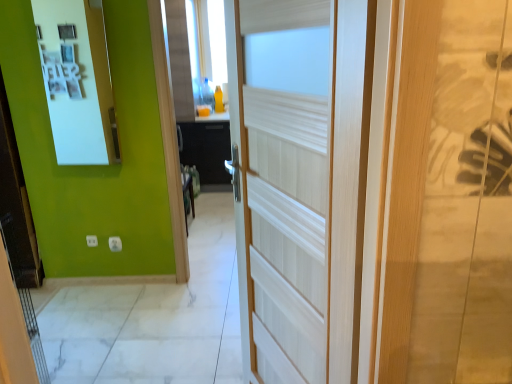
The width and height of the screenshot is (512, 384). I want to click on white glossy medicine cabinet at upper left, so click(x=77, y=81).

This screenshot has width=512, height=384. Describe the element at coordinates (77, 81) in the screenshot. I see `white glossy medicine cabinet at upper left` at that location.

What do you see at coordinates (376, 194) in the screenshot?
I see `white wood door at center` at bounding box center [376, 194].

This screenshot has height=384, width=512. Find the location of `white wood door at center`. white wood door at center is located at coordinates (376, 194).

At what (x,y) coordinates should I click in order to perform the action: click on white glossy medicine cabinet at upper left. Please return your answer as a coordinate pair (x, y). Looking at the image, I should click on (77, 81).

Is white glossy medicine cabinet at upper left to the left of white wood door at center from the viewer's perspective?

Indeed, white glossy medicine cabinet at upper left is positioned on the left side of white wood door at center.

Is white glossy medicine cabinet at upper left in front of or behind white wood door at center in the image?

white glossy medicine cabinet at upper left is behind white wood door at center.

Is point (59, 144) in front of point (260, 23)?

No, (59, 144) is behind (260, 23).

From the image's perspective, is white glossy medicine cabinet at upper left above or below white wood door at center?

Based on their image positions, white glossy medicine cabinet at upper left is located above white wood door at center.

From a real-world perspective, is white glossy medicine cabinet at upper left physically located above or below white wood door at center?

white glossy medicine cabinet at upper left is situated higher than white wood door at center in the real world.

Considering the relative sizes of white glossy medicine cabinet at upper left and white wood door at center in the image provided, is white glossy medicine cabinet at upper left wider than white wood door at center?

Incorrect, the width of white glossy medicine cabinet at upper left does not surpass that of white wood door at center.

In terms of height, does white glossy medicine cabinet at upper left look taller or shorter compared to white wood door at center?

In the image, white glossy medicine cabinet at upper left appears to be shorter than white wood door at center.

Between white glossy medicine cabinet at upper left and white wood door at center, which one has larger size?

white wood door at center is bigger.

Would you say white glossy medicine cabinet at upper left is inside or outside white wood door at center?

white glossy medicine cabinet at upper left cannot be found inside white wood door at center.

Can you see white glossy medicine cabinet at upper left touching white wood door at center?

No, white glossy medicine cabinet at upper left is not beside white wood door at center.

Is white glossy medicine cabinet at upper left facing towards white wood door at center?

No, white glossy medicine cabinet at upper left is not aimed at white wood door at center.

How many degrees apart are the facing directions of white glossy medicine cabinet at upper left and white wood door at center?

66.9 degrees.

At what (x,y) coordinates should I click in order to perform the action: click on door that appears on the right of white glossy medicine cabinet at upper left. Please return your answer as a coordinate pair (x, y). Looking at the image, I should click on (376, 194).

Considering the positions of objects white wood door at center and white glossy medicine cabinet at upper left in the image provided, who is more to the left, white wood door at center or white glossy medicine cabinet at upper left?

white glossy medicine cabinet at upper left is more to the left.

Consider the image. In the image, is white wood door at center positioned in front of or behind white glossy medicine cabinet at upper left?

In the image, white wood door at center appears in front of white glossy medicine cabinet at upper left.

Is point (510, 281) less distant than point (51, 86)?

Yes, it is.

From the image's perspective, is white wood door at center below white glossy medicine cabinet at upper left?

Yes, from the image's perspective, white wood door at center is beneath white glossy medicine cabinet at upper left.

From the picture: From a real-world perspective, is white wood door at center positioned above or below white glossy medicine cabinet at upper left?

white wood door at center is situated lower than white glossy medicine cabinet at upper left in the real world.

Is white wood door at center wider or thinner than white glossy medicine cabinet at upper left?

In the image, white wood door at center appears to be wider than white glossy medicine cabinet at upper left.

Considering the relative sizes of white wood door at center and white glossy medicine cabinet at upper left in the image provided, is white wood door at center shorter than white glossy medicine cabinet at upper left?

No.

Considering the sizes of objects white wood door at center and white glossy medicine cabinet at upper left in the image provided, who is bigger, white wood door at center or white glossy medicine cabinet at upper left?

Bigger between the two is white wood door at center.

Do you think white wood door at center is within white glossy medicine cabinet at upper left, or outside of it?

white wood door at center cannot be found inside white glossy medicine cabinet at upper left.

Would you say white wood door at center is a long distance from white glossy medicine cabinet at upper left?

white wood door at center is far away from white glossy medicine cabinet at upper left.

Is white wood door at center oriented towards white glossy medicine cabinet at upper left?

Answer: No, white wood door at center is not facing towards white glossy medicine cabinet at upper left.

Find the location of a particular element. The image size is (512, 384). medicine cabinet that is on the left side of white wood door at center is located at coordinates (77, 81).

What are the coordinates of `medicine cabinet located above the white wood door at center (from the image's perspective)` in the screenshot? It's located at (77, 81).

Image resolution: width=512 pixels, height=384 pixels. Find the location of `door below the white glossy medicine cabinet at upper left (from a real-world perspective)`. door below the white glossy medicine cabinet at upper left (from a real-world perspective) is located at coordinates (376, 194).